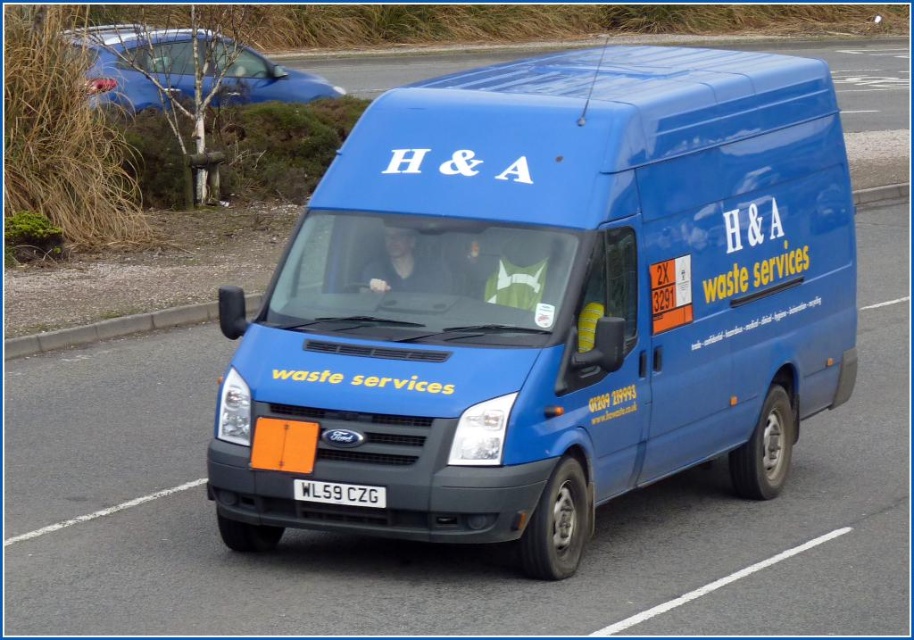
You are a traffic officer checking license plates. You see the matte blue van at center and the white plastic license plate at center. Which object is closer to you?

The matte blue van at center is closer to you because the white plastic license plate at center is behind it.